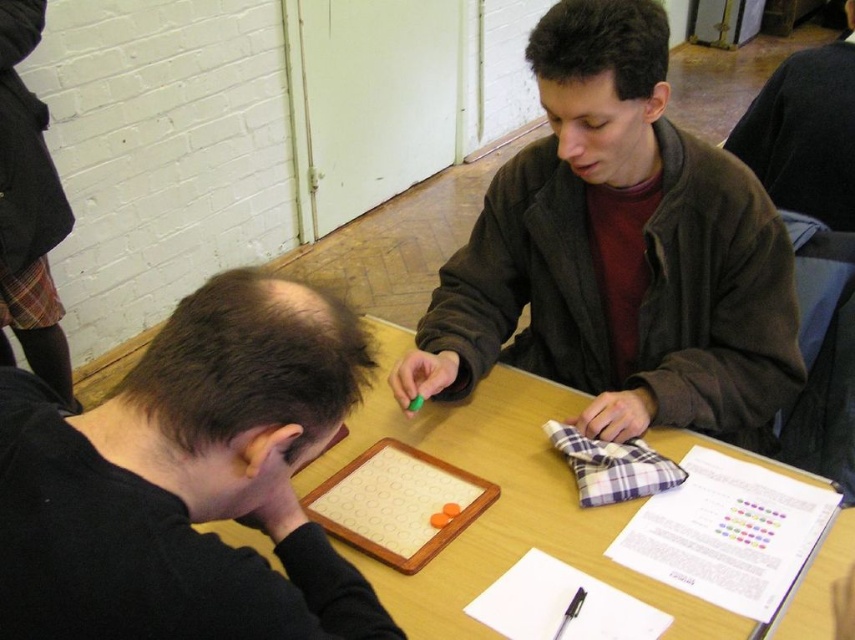
Question: Does dark brown jacket at center appear over black matte shirt at lower left?

Choices:
 (A) no
 (B) yes

Answer: (B)

Question: Is black matte shirt at lower left above wooden table at center?

Choices:
 (A) yes
 (B) no

Answer: (A)

Question: Can you confirm if black matte shirt at lower left is bigger than wooden table at center?

Choices:
 (A) yes
 (B) no

Answer: (B)

Question: Which point is closer to the camera?

Choices:
 (A) (684, 602)
 (B) (650, 177)
 (C) (266, 461)

Answer: (C)

Question: Which point is farther from the camera taking this photo?

Choices:
 (A) (504, 481)
 (B) (579, 264)
 (C) (92, 500)

Answer: (B)

Question: Among these objects, which one is farthest from the camera?

Choices:
 (A) wooden table at center
 (B) dark brown jacket at center
 (C) black matte shirt at lower left

Answer: (B)